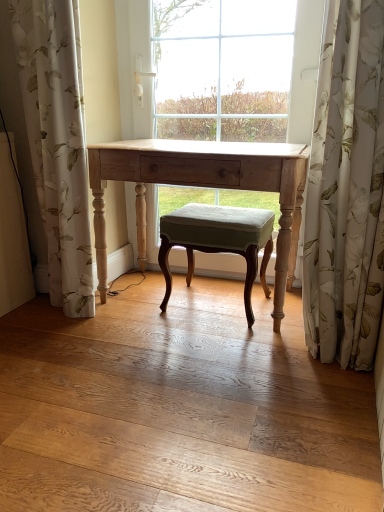
Question: Looking at their shapes, would you say light wood table at center is wider or thinner than white floral fabric at left, positioned as the second curtain in right-to-left order?

Choices:
 (A) wide
 (B) thin

Answer: (A)

Question: Looking at the image, does light wood table at center seem bigger or smaller compared to white floral fabric at left, the 1th curtain when ordered from left to right?

Choices:
 (A) small
 (B) big

Answer: (B)

Question: Which object is positioned closest to the white floral fabric at left, the 1th curtain when ordered from left to right?

Choices:
 (A) light wood table at center
 (B) white floral fabric at right, which appears as the 1th curtain when viewed from the right
 (C) velvet green stool at center

Answer: (A)

Question: Considering the real-world distances, which object is closest to the white floral fabric at right, which appears as the 1th curtain when viewed from the right?

Choices:
 (A) velvet green stool at center
 (B) light wood table at center
 (C) white floral fabric at left, positioned as the second curtain in right-to-left order

Answer: (B)